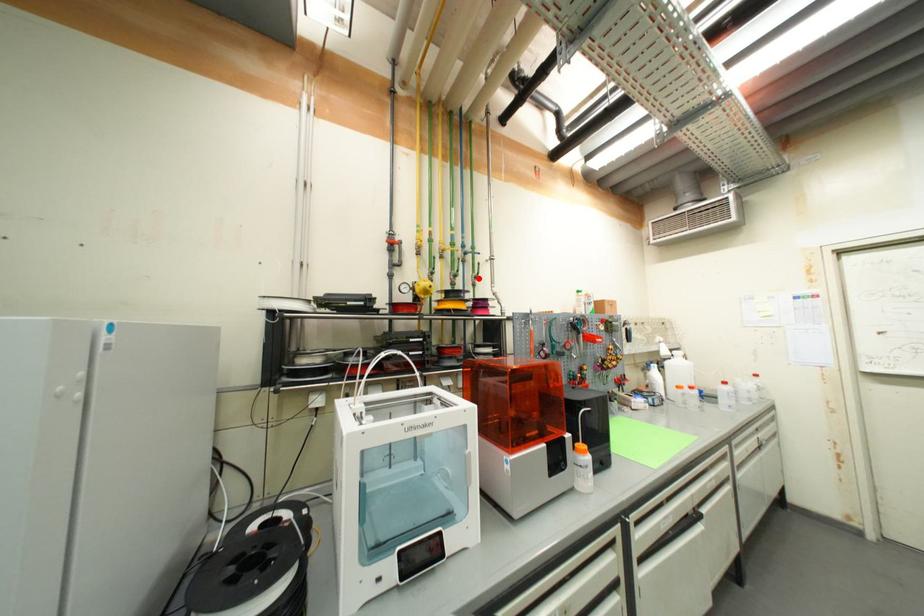
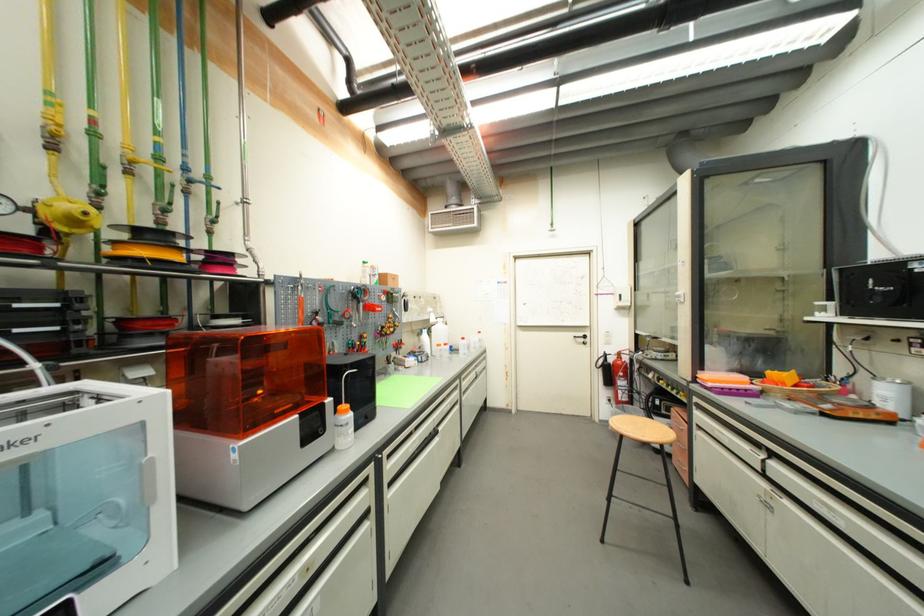
The point at the highlighted location is marked in the first image. Where is the corresponding point in the second image?

(213, 222)